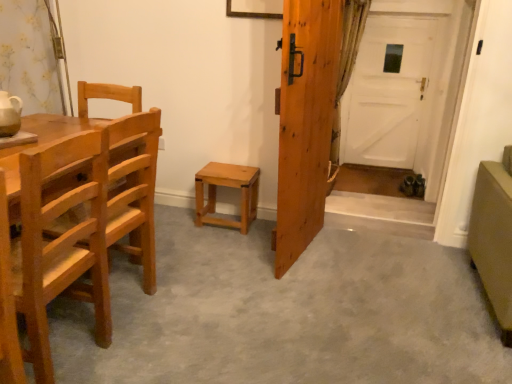
Question: Is green textured curtain at right oriented away from wooden door at center, the first door viewed from the front?

Choices:
 (A) no
 (B) yes

Answer: (A)

Question: Does green textured curtain at right appear on the right side of wooden door at center, which is counted as the 1th door, starting from the left?

Choices:
 (A) yes
 (B) no

Answer: (A)

Question: Can you confirm if green textured curtain at right is positioned to the left of wooden door at center, the first door viewed from the front?

Choices:
 (A) no
 (B) yes

Answer: (A)

Question: Is the position of green textured curtain at right more distant than that of wooden door at center, the first door viewed from the front?

Choices:
 (A) no
 (B) yes

Answer: (B)

Question: Is green textured curtain at right not within wooden door at center, which is counted as the 1th door, starting from the left?

Choices:
 (A) yes
 (B) no

Answer: (A)

Question: Does green textured curtain at right have a lesser height compared to wooden door at center, the 2th door when ordered from back to front?

Choices:
 (A) yes
 (B) no

Answer: (B)

Question: From the image's perspective, is light brown wood stool at center below white matte door at center, the first door viewed from the back?

Choices:
 (A) no
 (B) yes

Answer: (B)

Question: Is light brown wood stool at center oriented away from white matte door at center, the 1th door viewed from the right?

Choices:
 (A) no
 (B) yes

Answer: (B)

Question: Does light brown wood stool at center have a smaller size compared to white matte door at center, the 1th door viewed from the right?

Choices:
 (A) no
 (B) yes

Answer: (B)

Question: Is white matte door at center, arranged as the second door when viewed from the left, inside light brown wood stool at center?

Choices:
 (A) yes
 (B) no

Answer: (B)

Question: From a real-world perspective, is light brown wood stool at center on white matte door at center, the 1th door viewed from the right?

Choices:
 (A) no
 (B) yes

Answer: (A)

Question: Is light brown wood stool at center next to white matte door at center, arranged as the second door when viewed from the left, and touching it?

Choices:
 (A) yes
 (B) no

Answer: (B)

Question: Is green textured curtain at right taller than light brown wood chair at left, the second chair when ordered from back to front?

Choices:
 (A) no
 (B) yes

Answer: (B)